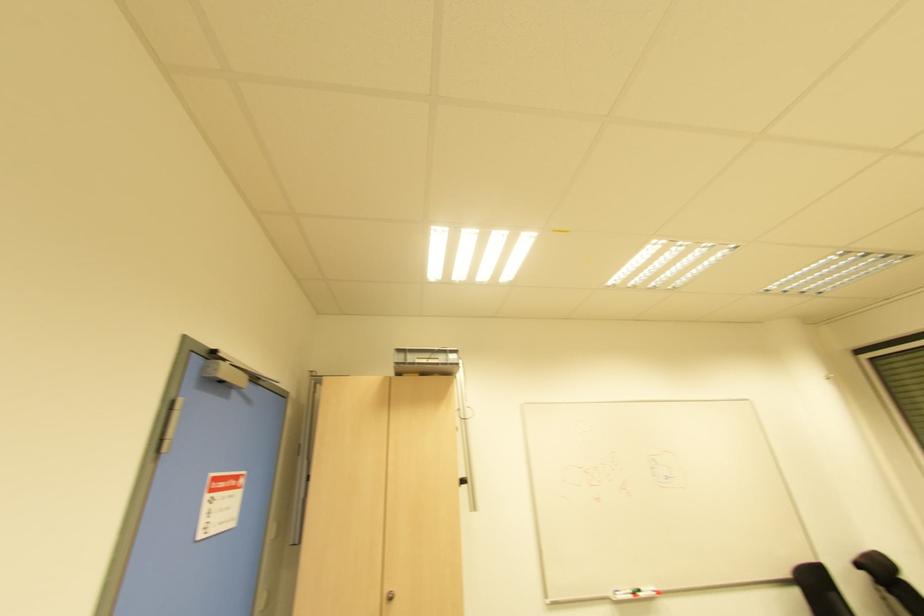
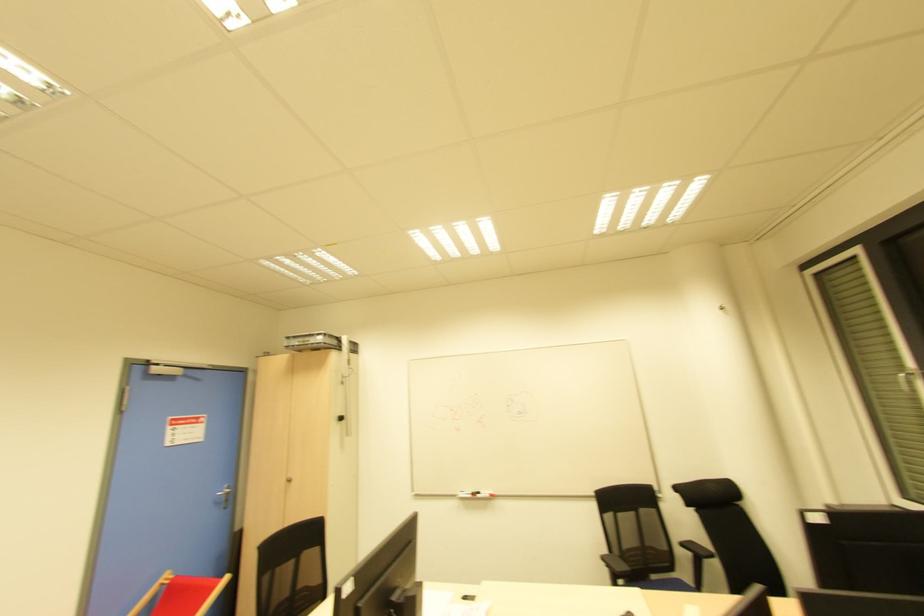
Question: What movement of the cameraman would produce the second image?

Choices:
 (A) Left
 (B) Right
 (C) Forward
 (D) Backward

Answer: (B)